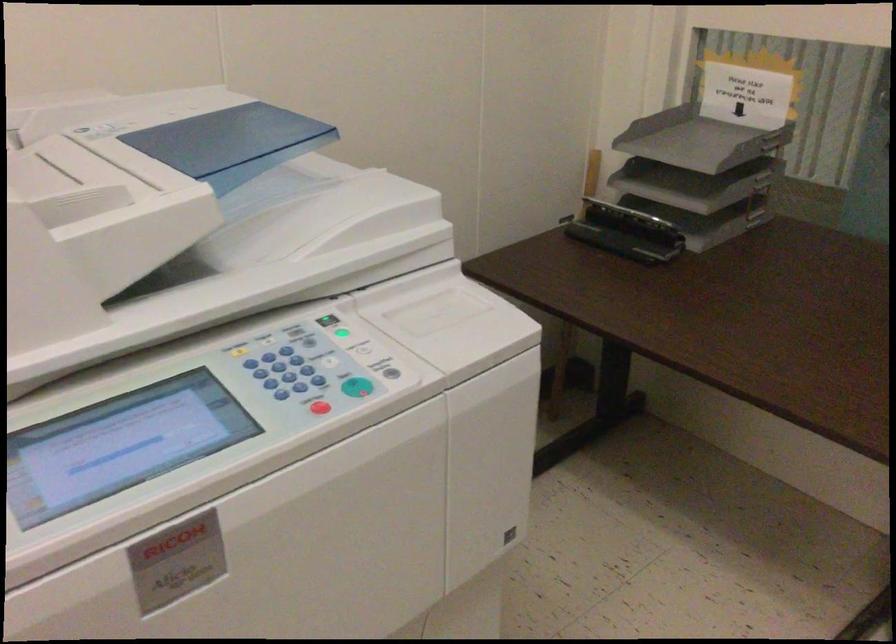
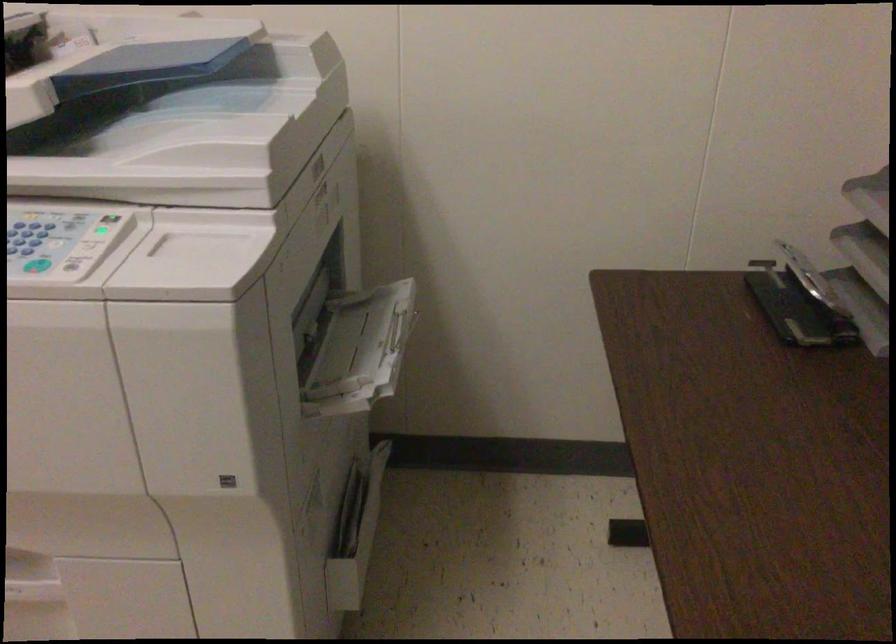
In the second image, find the point that corresponds to point 282,210 in the first image.

(173, 126)